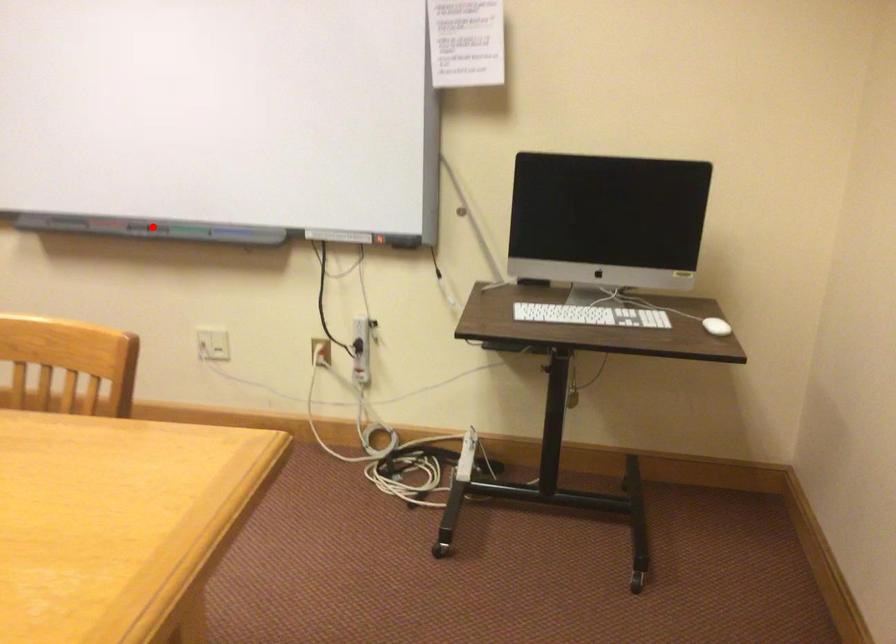
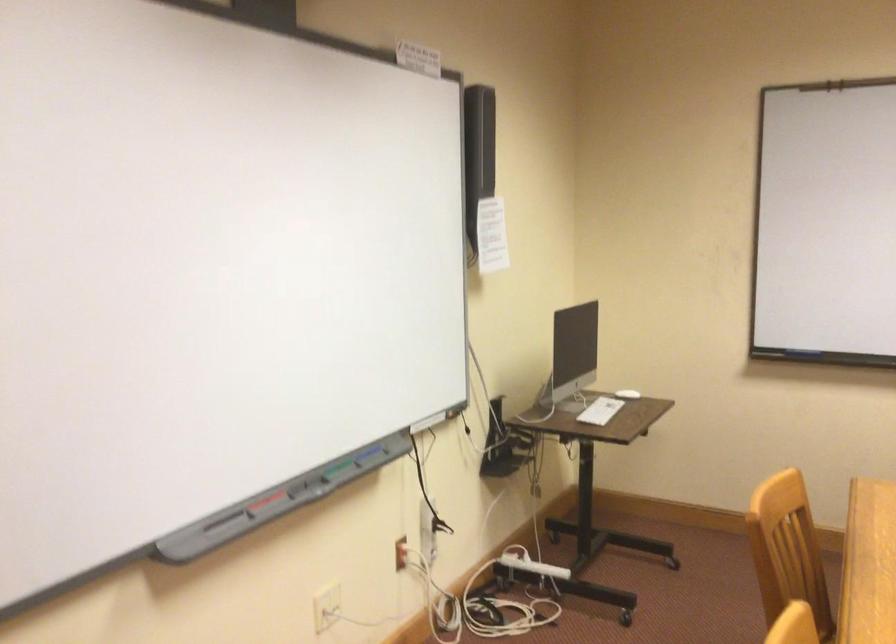
In the second image, find the point that corresponds to the highlighted location in the first image.

(302, 484)